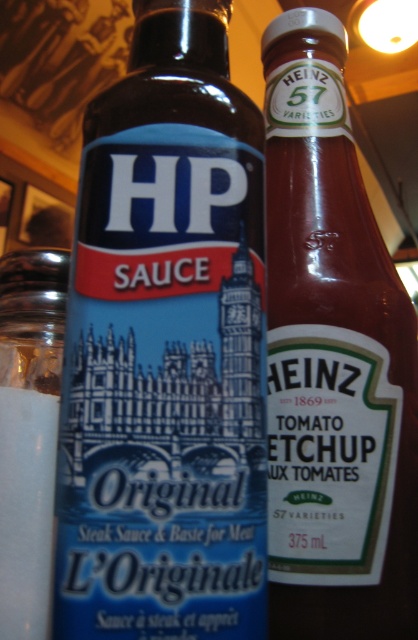
Question: Which of the following is the farthest from the observer?

Choices:
 (A) (333, 308)
 (B) (2, 506)
 (C) (246, 282)

Answer: (A)

Question: Is matte plastic hp sauce at left thinner than clear glass salt shaker at left?

Choices:
 (A) yes
 (B) no

Answer: (B)

Question: Which object is the farthest from the matte plastic hp sauce at left?

Choices:
 (A) clear glass salt shaker at left
 (B) matte glass bottle of ketchup at center

Answer: (A)

Question: Can you confirm if matte plastic hp sauce at left is positioned to the right of clear glass salt shaker at left?

Choices:
 (A) no
 (B) yes

Answer: (B)

Question: Based on their relative distances, which object is nearer to the matte glass bottle of ketchup at center?

Choices:
 (A) clear glass salt shaker at left
 (B) matte plastic hp sauce at left

Answer: (B)

Question: Is matte plastic hp sauce at left further to camera compared to clear glass salt shaker at left?

Choices:
 (A) no
 (B) yes

Answer: (A)